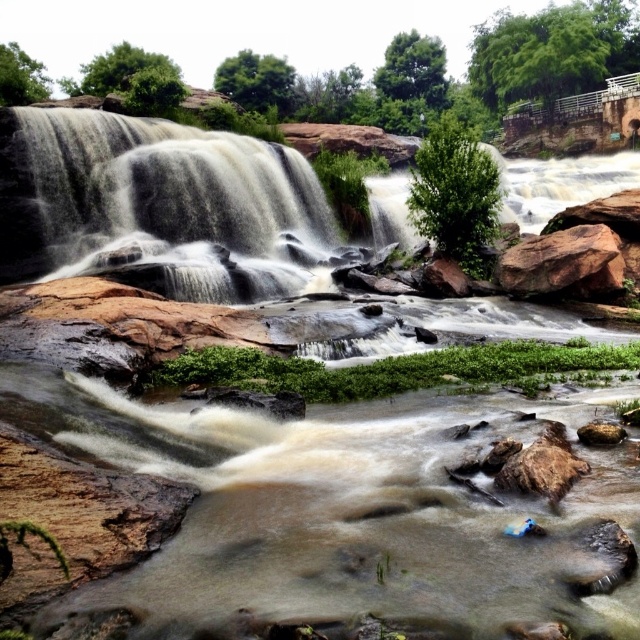
You are standing at the edge of the waterfall and want to place a small decorative rock at each of the two points marked in the image. The first point is at coordinates point (573, 292) and the second is at point (611, 435). Which point is closer to you so that you can place the rock without needing to move further back?

The point (573, 292) is closer to you than the point (611, 435), so you can place the decorative rock there without moving further back.